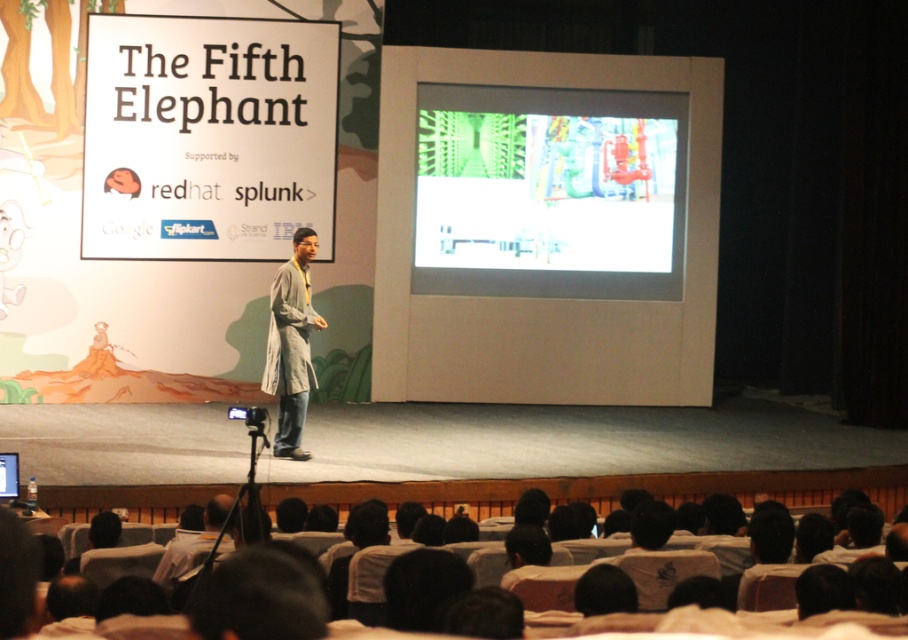
Question: Can you confirm if white glossy projection screen at center is positioned above gray fabric coat at center?

Choices:
 (A) no
 (B) yes

Answer: (B)

Question: Which of the following is the closest to the observer?

Choices:
 (A) white glossy projection screen at center
 (B) white paper at upper left
 (C) gray fabric coat at center

Answer: (C)

Question: Which object is the farthest from the matte white screen at center?

Choices:
 (A) gray fabric coat at center
 (B) white paper at upper left
 (C) white glossy projection screen at center

Answer: (C)

Question: Is gray fabric coat at center thinner than matte white screen at center?

Choices:
 (A) yes
 (B) no

Answer: (B)

Question: Can you confirm if gray fabric coat at center is positioned to the left of matte white screen at center?

Choices:
 (A) yes
 (B) no

Answer: (B)

Question: Which point is farther from the camera taking this photo?

Choices:
 (A) (319, 317)
 (B) (8, 456)
 (C) (252, 45)

Answer: (C)